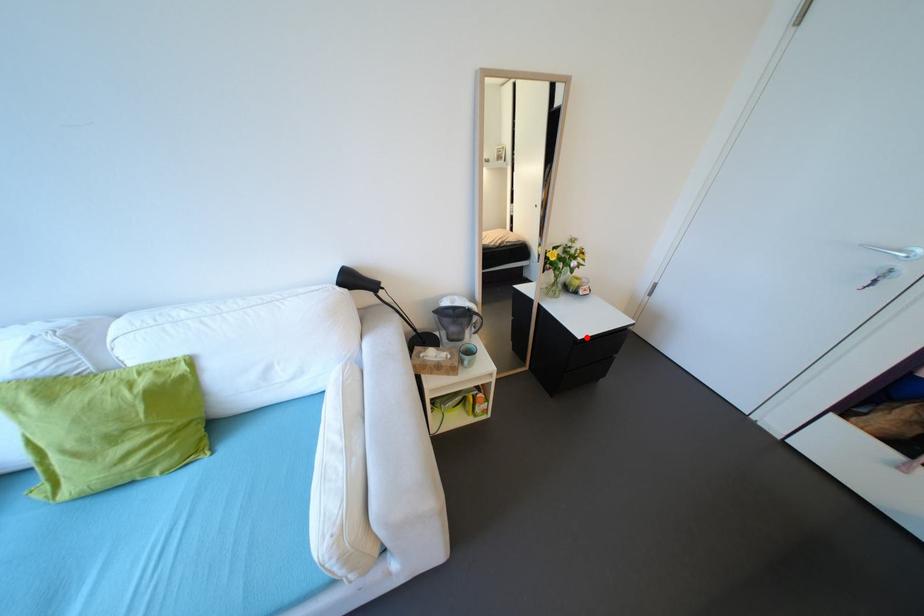
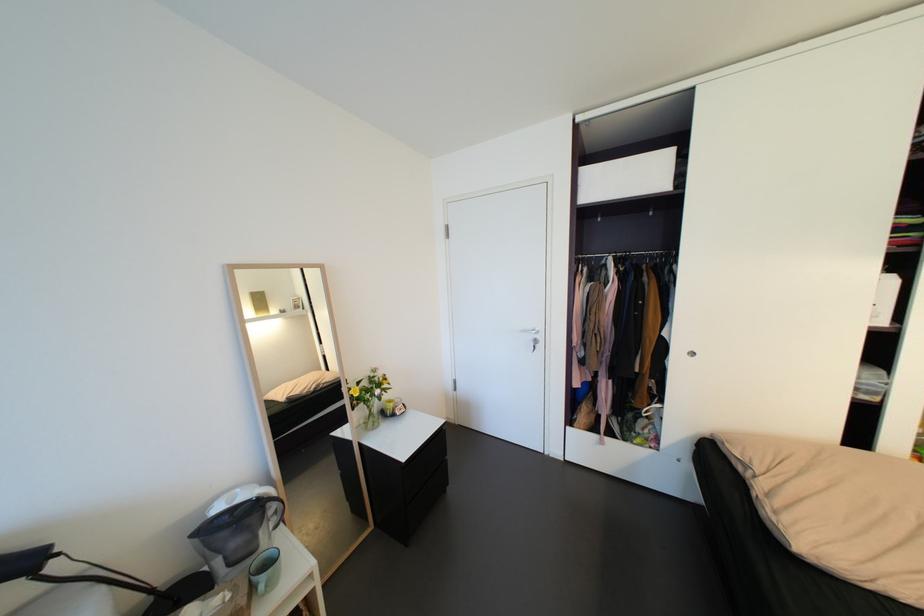
Question: I am providing you with two images of the same scene from different viewpoints. In image1, a red point is highlighted. Considering the same 3D point in image2, which of the following is correct?

Choices:
 (A) It is closer
 (B) It is farther

Answer: (B)